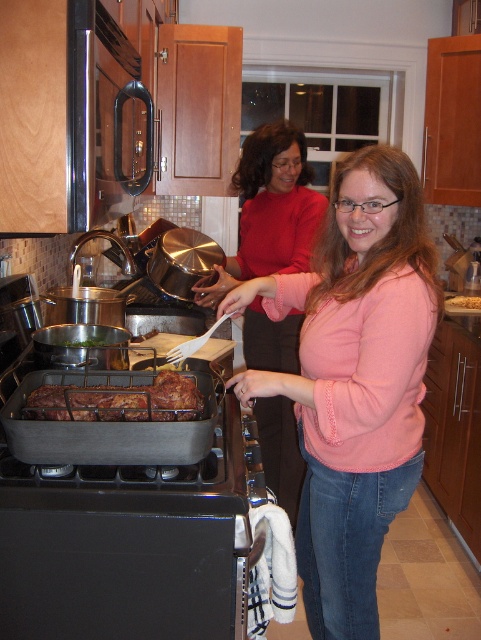
Question: Among these objects, which one is nearest to the camera?

Choices:
 (A) pink matte sweater at center
 (B) brown crispy meat at center
 (C) pink sweater at center

Answer: (B)

Question: Does pink sweater at center have a larger size compared to golden brown bread at center?

Choices:
 (A) no
 (B) yes

Answer: (B)

Question: Does pink matte sweater at center have a lesser width compared to pink sweater at center?

Choices:
 (A) no
 (B) yes

Answer: (B)

Question: Which is farther from the golden brown bread at center?

Choices:
 (A) brown crispy meat at center
 (B) pink matte sweater at center
 (C) pink sweater at center

Answer: (A)

Question: Can you confirm if pink matte sweater at center is wider than golden brown bread at center?

Choices:
 (A) no
 (B) yes

Answer: (B)

Question: Among these points, which one is farthest from the camera?

Choices:
 (A) (370, 397)
 (B) (261, 216)

Answer: (B)